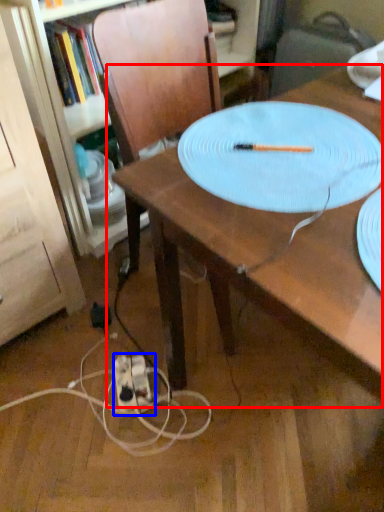
Question: Which point is further to the camera, table (highlighted by a red box) or extension cord (highlighted by a blue box)?

Choices:
 (A) table
 (B) extension cord

Answer: (B)